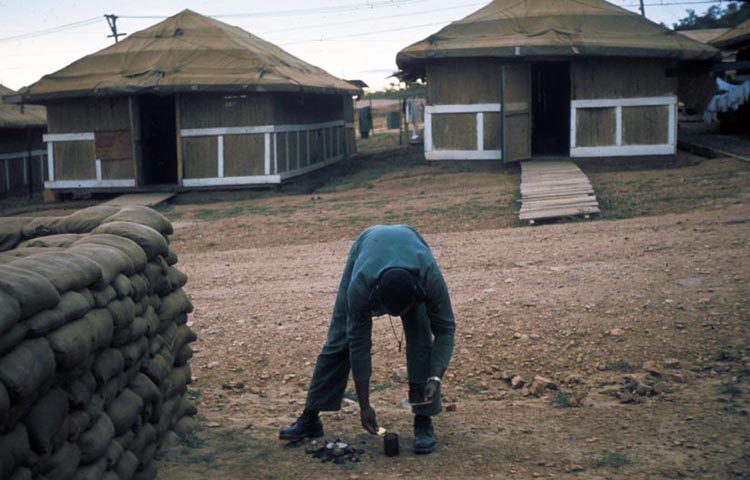
The height and width of the screenshot is (480, 750). I want to click on door, so click(152, 148), click(549, 109).